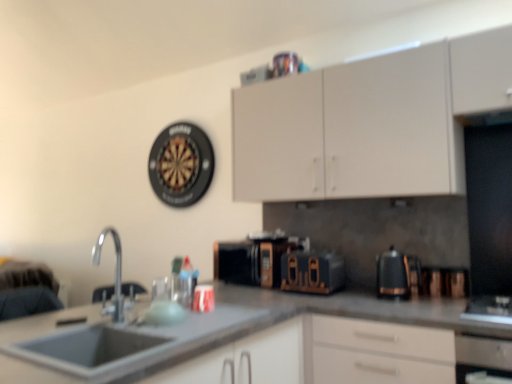
Question: In the image, is white matte cabinet at upper center on the left side or the right side of black plastic coffee pot at right?

Choices:
 (A) right
 (B) left

Answer: (B)

Question: In terms of height, does white matte cabinet at upper center look taller or shorter compared to black plastic coffee pot at right?

Choices:
 (A) short
 (B) tall

Answer: (B)

Question: Based on their relative distances, which object is farther from the silver metallic faucet at lower left?

Choices:
 (A) black metallic toaster at center, the 2th appliance positioned from the left
 (B) black matte microwave at center, which appears as the 2th appliance when viewed from the right
 (C) gray matte sink at lower left
 (D) smooth gray countertop at center
 (E) white matte cabinet at upper center

Answer: (E)

Question: Considering the real-world distances, which object is farthest from the gray matte sink at lower left?

Choices:
 (A) silver metallic faucet at lower left
 (B) black matte microwave at center, which appears as the 2th appliance when viewed from the right
 (C) black metallic toaster at center, which appears as the first appliance when viewed from the right
 (D) black plastic coffee pot at right
 (E) black plastic dartboard at upper center

Answer: (A)